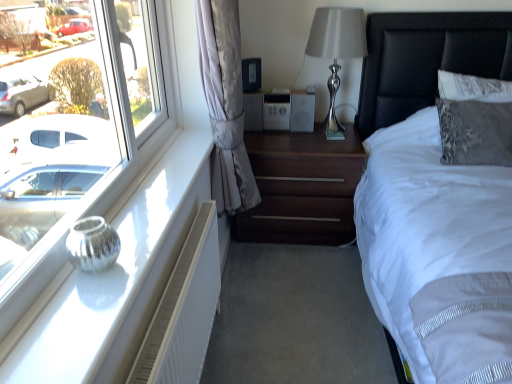
Question: Is white fabric bed at right looking in the opposite direction of satin silver lamp at upper right?

Choices:
 (A) no
 (B) yes

Answer: (A)

Question: Is white fabric bed at right shorter than satin silver lamp at upper right?

Choices:
 (A) no
 (B) yes

Answer: (A)

Question: Can you confirm if white fabric bed at right is positioned to the right of satin silver lamp at upper right?

Choices:
 (A) no
 (B) yes

Answer: (B)

Question: Can satin silver lamp at upper right be found inside white fabric bed at right?

Choices:
 (A) yes
 (B) no

Answer: (B)

Question: Is white fabric bed at right wider than satin silver lamp at upper right?

Choices:
 (A) yes
 (B) no

Answer: (A)

Question: Is dark wood nightstand at center taller or shorter than satin silver lamp at upper right?

Choices:
 (A) short
 (B) tall

Answer: (A)

Question: From a real-world perspective, is dark wood nightstand at center positioned above or below satin silver lamp at upper right?

Choices:
 (A) above
 (B) below

Answer: (B)

Question: Based on their sizes in the image, would you say dark wood nightstand at center is bigger or smaller than satin silver lamp at upper right?

Choices:
 (A) small
 (B) big

Answer: (B)

Question: Considering the relative positions of dark wood nightstand at center and satin silver lamp at upper right in the image provided, is dark wood nightstand at center to the left or to the right of satin silver lamp at upper right?

Choices:
 (A) right
 (B) left

Answer: (B)

Question: From a real-world perspective, relative to dark wood nightstand at center, is silver metallic vase at left vertically above or below?

Choices:
 (A) below
 (B) above

Answer: (B)

Question: Relative to dark wood nightstand at center, is silver metallic vase at left in front or behind?

Choices:
 (A) front
 (B) behind

Answer: (A)

Question: In terms of height, does silver metallic vase at left look taller or shorter compared to dark wood nightstand at center?

Choices:
 (A) short
 (B) tall

Answer: (A)

Question: Is silver metallic vase at left wider or thinner than dark wood nightstand at center?

Choices:
 (A) thin
 (B) wide

Answer: (A)

Question: Considering their positions, is satin silver lamp at upper right located in front of or behind white fabric bed at right?

Choices:
 (A) behind
 (B) front

Answer: (A)

Question: In the image, is satin silver lamp at upper right on the left side or the right side of white fabric bed at right?

Choices:
 (A) right
 (B) left

Answer: (B)